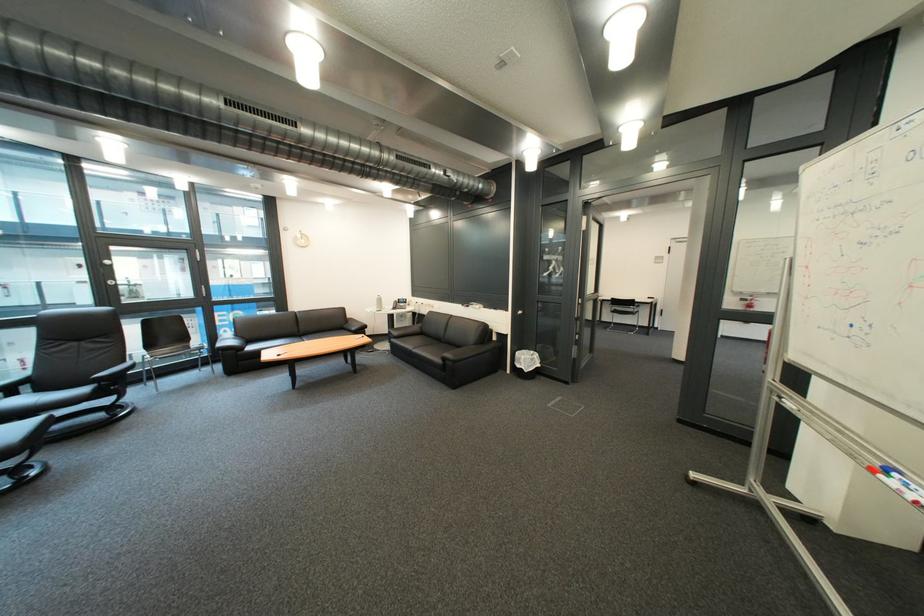
The location [379,302] corresponds to which object?

It corresponds to the white dispenser bottle in the image.